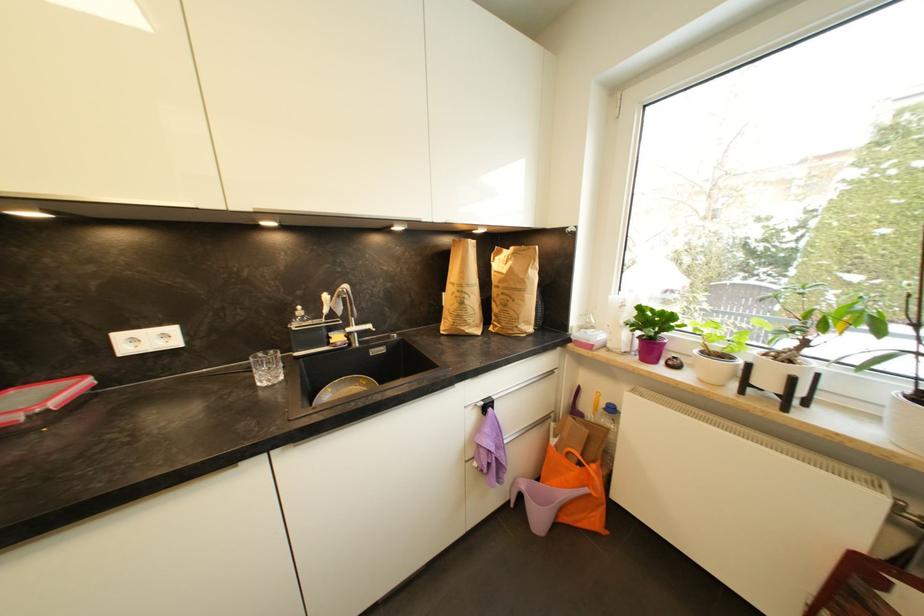
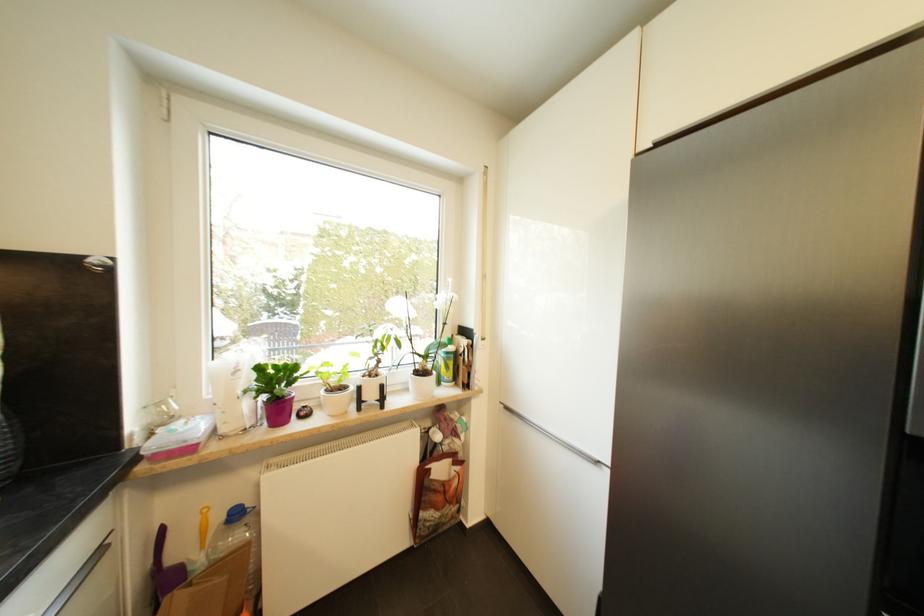
Where in the second image is the point corresponding to pixel 655 352 from the first image?

(285, 411)